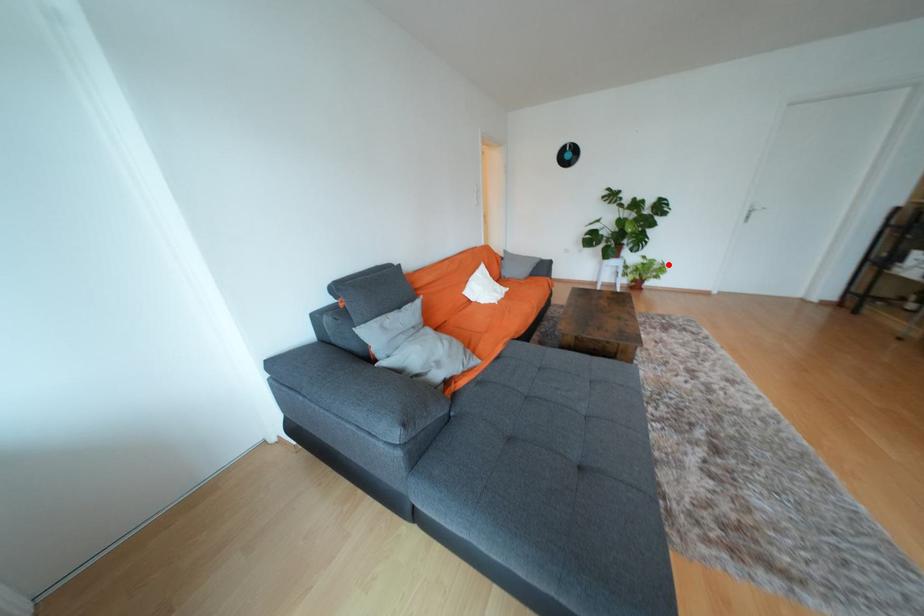
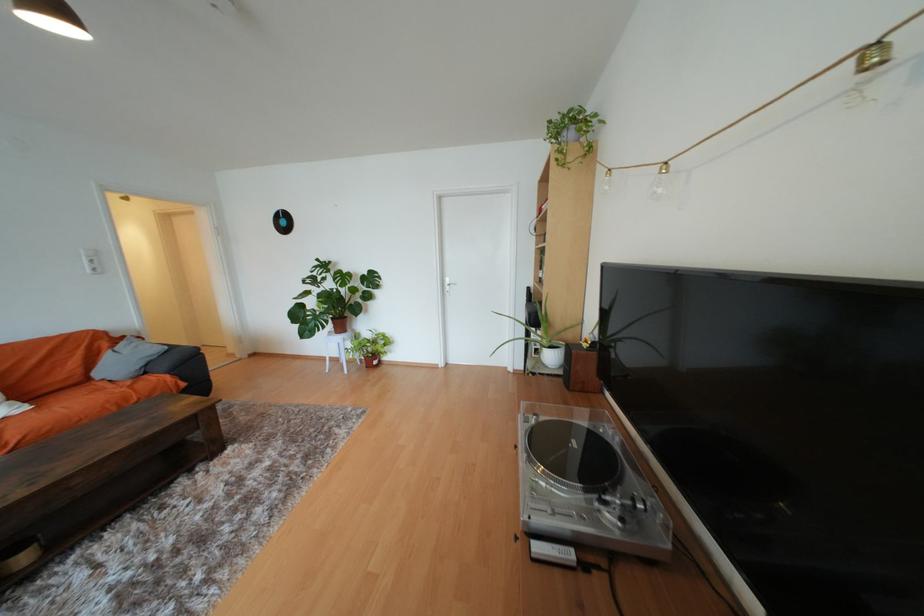
Question: I am providing you with two images of the same scene from different viewpoints. Image1 has a red point marked. In image2, the corresponding 3D location appears at what relative position? Reply with the corresponding letter.

Choices:
 (A) Closer
 (B) Farther

Answer: (B)